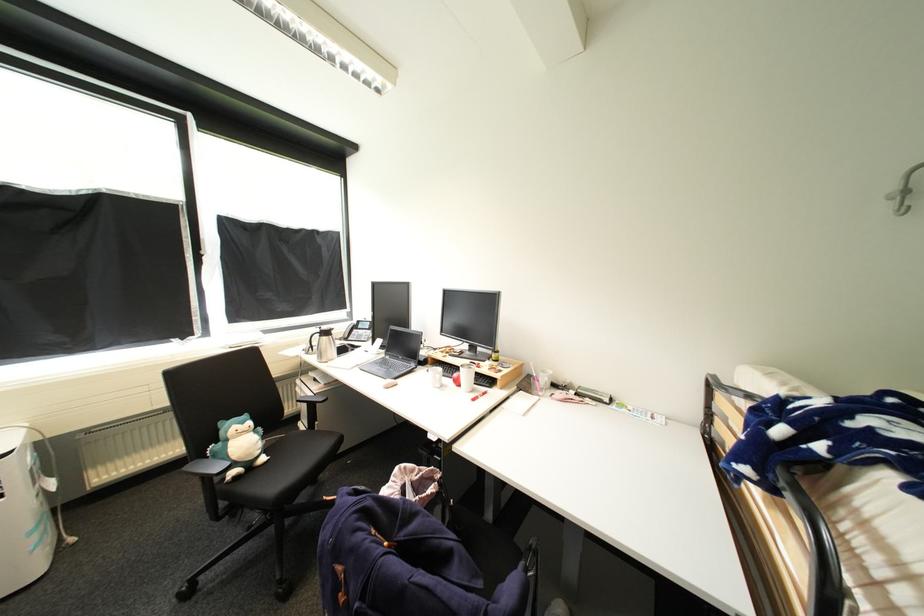
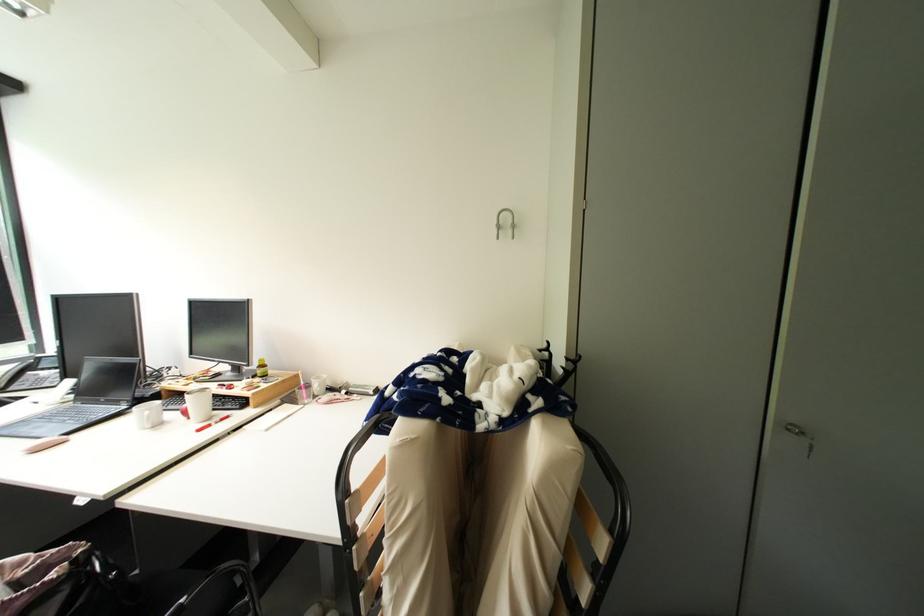
Question: The images are taken continuously from a first-person perspective. In which direction is your viewpoint rotating?

Choices:
 (A) Left
 (B) Right
 (C) Up
 (D) Down

Answer: (B)